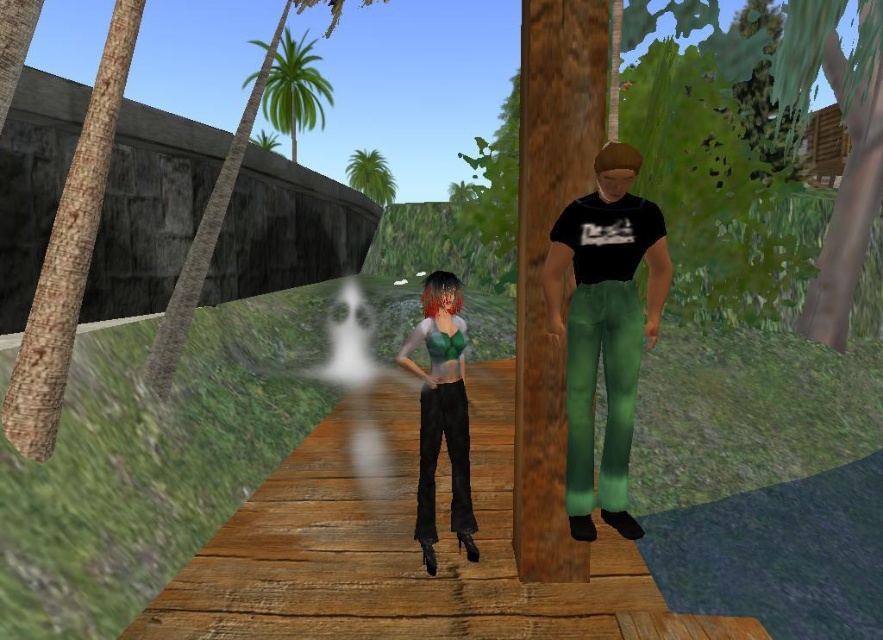
You are a character in this virtual environment and need to jump from the wooden plank at center to the character on the right. Can you make the jump successfully?

The distance between the wooden plank at center and the character on the right is 12.86 feet, which is quite far. Without additional assistance or abilities, it may be difficult to jump that distance successfully.